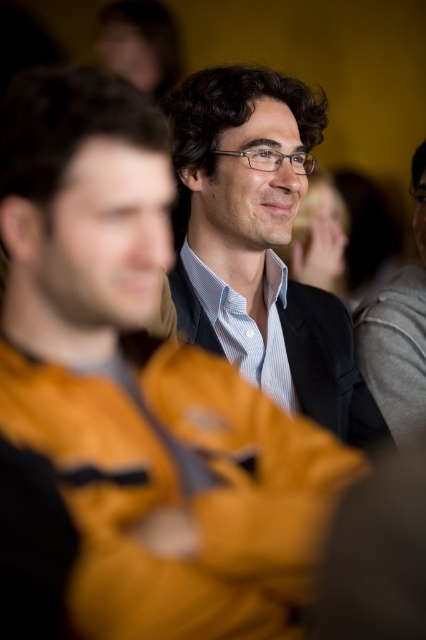
Question: Among these objects, which one is nearest to the camera?

Choices:
 (A) gray wool sweater at right
 (B) matte black suit at center

Answer: (B)

Question: Is matte black suit at center to the right of gray wool sweater at right from the viewer's perspective?

Choices:
 (A) no
 (B) yes

Answer: (A)

Question: Which of the following is the farthest from the observer?

Choices:
 (A) (222, 237)
 (B) (419, 348)

Answer: (B)

Question: Can you confirm if matte black suit at center is positioned to the left of gray wool sweater at right?

Choices:
 (A) yes
 (B) no

Answer: (A)

Question: Is matte black suit at center below gray wool sweater at right?

Choices:
 (A) yes
 (B) no

Answer: (B)

Question: Which point is farther from the camera taking this photo?

Choices:
 (A) (388, 300)
 (B) (319, 298)

Answer: (A)